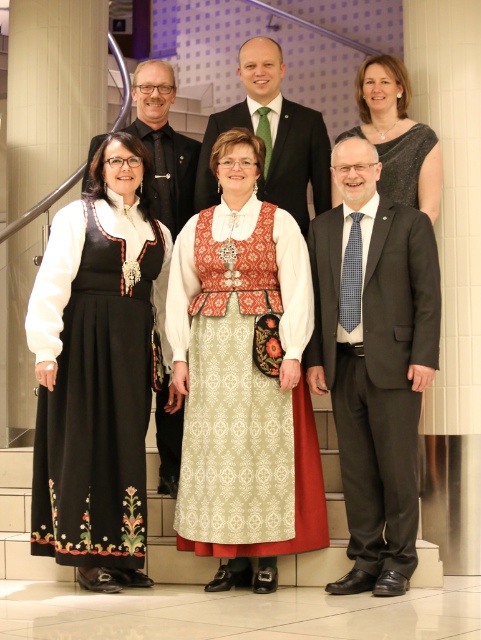
Question: Considering the relative positions of black woven dress at lower left and green textured tie at upper center in the image provided, where is black woven dress at lower left located with respect to green textured tie at upper center?

Choices:
 (A) left
 (B) right

Answer: (A)

Question: Can you confirm if matte black suit at center is wider than black satin dress at upper center?

Choices:
 (A) yes
 (B) no

Answer: (B)

Question: Among these objects, which one is farthest from the camera?

Choices:
 (A) matte black suit at center
 (B) black woven dress at lower left

Answer: (A)

Question: Which point is farther to the camera?

Choices:
 (A) (192, 236)
 (B) (104, 384)

Answer: (A)

Question: Which of the following is the farthest from the observer?

Choices:
 (A) patterned fabric dress at center
 (B) dark gray suit at center
 (C) matte black suit at center

Answer: (C)

Question: Does patterned fabric dress at center come in front of black satin dress at upper center?

Choices:
 (A) yes
 (B) no

Answer: (A)